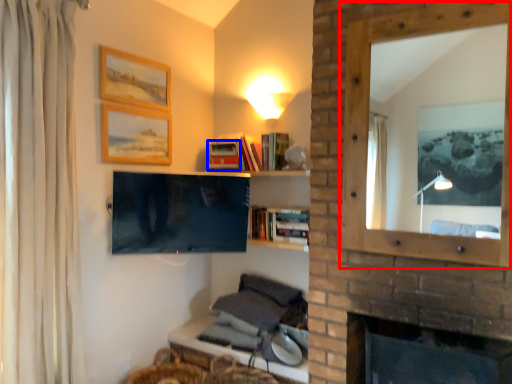
Question: Among these objects, which one is farthest to the camera, window frame (highlighted by a red box) or book (highlighted by a blue box)?

Choices:
 (A) window frame
 (B) book

Answer: (B)